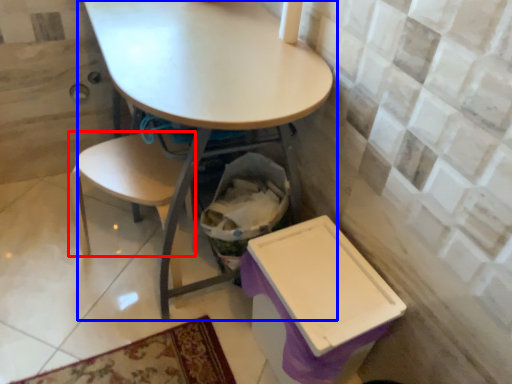
Question: Which object appears closest to the camera in this image, chair (highlighted by a red box) or table (highlighted by a blue box)?

Choices:
 (A) chair
 (B) table

Answer: (B)